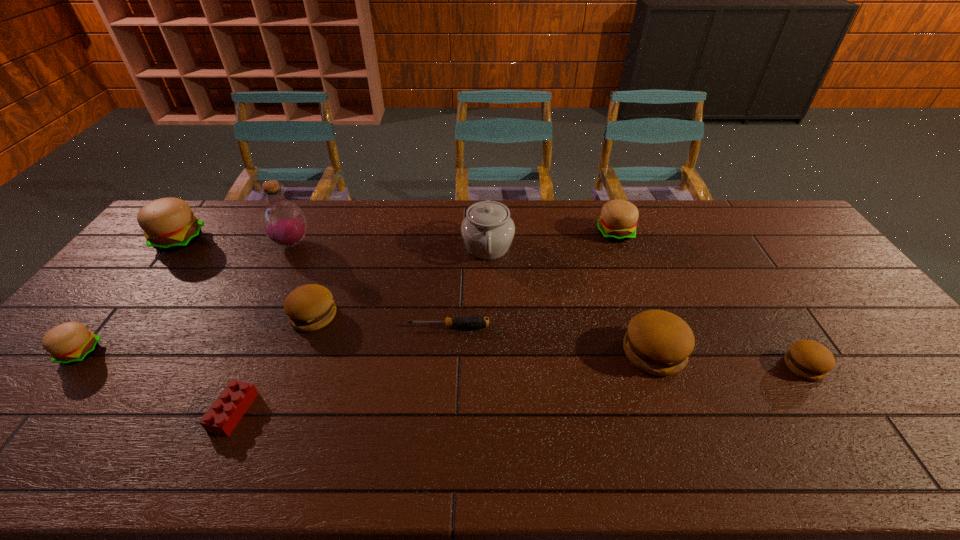
The width and height of the screenshot is (960, 540). Identify the location of purple bottle. (283, 222).

Where is `bottle`? bottle is located at coordinates (283, 222).

This screenshot has height=540, width=960. I want to click on white chinaware, so click(487, 230).

This screenshot has height=540, width=960. What are the coordinates of `the biggest beige hamburger` in the screenshot? It's located at (169, 224).

The image size is (960, 540). In order to click on the second biggest beige hamburger in this screenshot , I will do `click(618, 220)`.

Identify the location of the second brown hamburger from right to left. (658, 342).

In order to click on the leftmost brown hamburger in this screenshot , I will do `click(310, 307)`.

Locate an element on the screen. This screenshot has width=960, height=540. the second biggest brown hamburger is located at coordinates (310, 307).

In order to click on the nearest beige hamburger in this screenshot , I will do `click(69, 343)`.

At what (x,y) coordinates should I click in order to perform the action: click on the rightmost brown hamburger. Please return your answer as a coordinate pair (x, y). Looking at the image, I should click on (808, 359).